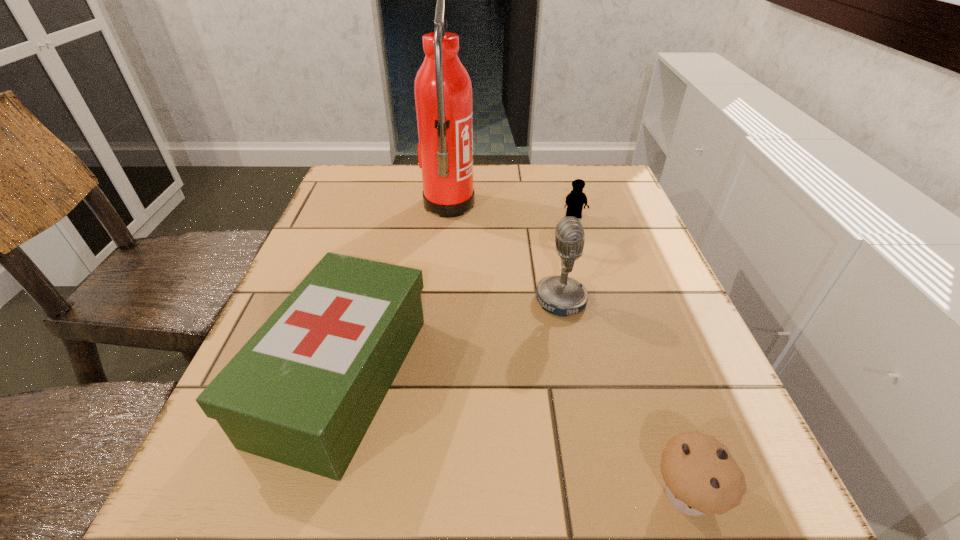
Identify the location of vacant space located on the front-facing side of the Lego. (601, 311).

Locate an element on the screen. The image size is (960, 540). free location located 0.340m on the left of the muffin is located at coordinates (389, 494).

Where is `object present at the far edge`? The width and height of the screenshot is (960, 540). object present at the far edge is located at coordinates (443, 91).

What are the coordinates of `the first-aid kit located at the near edge` in the screenshot? It's located at (304, 389).

The width and height of the screenshot is (960, 540). I want to click on muffin present at the near edge, so pos(700,476).

The image size is (960, 540). I want to click on object located at the left edge, so click(304, 389).

I want to click on Lego present at the right edge, so click(575, 200).

You are a GUI agent. You are given a task and a screenshot of the screen. Output one action in this format:
    pyautogui.click(x=<x>, y=<y>)
    Task: Click on the muffin that is positioned at the right edge
    This screenshot has width=960, height=540.
    Given the screenshot: What is the action you would take?
    pyautogui.click(x=700, y=476)

In order to click on object that is positioned at the near left corner in this screenshot , I will do `click(304, 389)`.

What are the coordinates of `object present at the near right corner` in the screenshot? It's located at (700, 476).